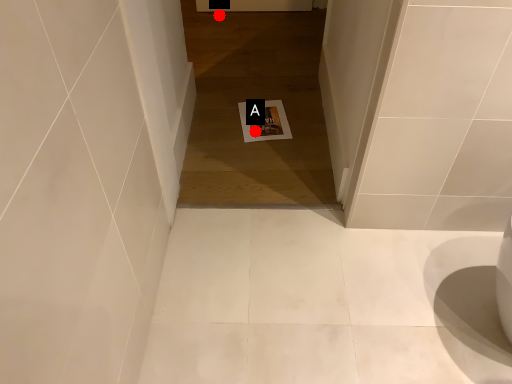
Question: Two points are circled on the image, labeled by A and B beside each circle. Which of the following is the farthest from the observer?

Choices:
 (A) A is further
 (B) B is further

Answer: (B)